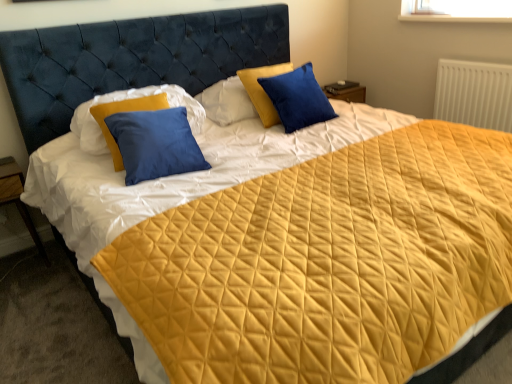
Where is `wooden at left`? wooden at left is located at coordinates (18, 198).

Find the location of `blue velvet pillow at upper center, which is counted as the second pillow, starting from the left`. blue velvet pillow at upper center, which is counted as the second pillow, starting from the left is located at coordinates (298, 98).

Locate an element on the screen. white textured radiator at upper right is located at coordinates (474, 94).

Find the location of a particular element. Image resolution: width=512 pixels, height=384 pixels. wooden at left is located at coordinates (18, 198).

Considering the sizes of objects matte blue pillow at center, which is the first pillow from left to right, and white textured radiator at upper right in the image provided, who is smaller, matte blue pillow at center, which is the first pillow from left to right, or white textured radiator at upper right?

Smaller between the two is white textured radiator at upper right.

From a real-world perspective, is matte blue pillow at center, which is the first pillow from left to right, positioned above or below white textured radiator at upper right?

matte blue pillow at center, which is the first pillow from left to right, is above white textured radiator at upper right.

Is blue velvet pillow at upper center, which ranks as the 1th pillow in right-to-left order, looking in the opposite direction of matte blue pillow at center, which is the first pillow from left to right?

No, blue velvet pillow at upper center, which ranks as the 1th pillow in right-to-left order, is not facing the opposite direction of matte blue pillow at center, which is the first pillow from left to right.

From the picture: Would you consider blue velvet pillow at upper center, which ranks as the 1th pillow in right-to-left order, to be distant from matte blue pillow at center, which is the first pillow from left to right?

No.

In the scene shown: Looking at their sizes, would you say blue velvet pillow at upper center, which is counted as the second pillow, starting from the left, is wider or thinner than matte blue pillow at center, which is the first pillow from left to right?

Clearly, blue velvet pillow at upper center, which is counted as the second pillow, starting from the left, has less width compared to matte blue pillow at center, which is the first pillow from left to right.

Is blue velvet pillow at upper center, which ranks as the 1th pillow in right-to-left order, spatially inside wooden at left, or outside of it?

blue velvet pillow at upper center, which ranks as the 1th pillow in right-to-left order, cannot be found inside wooden at left.

Considering the relative sizes of blue velvet pillow at upper center, which is counted as the second pillow, starting from the left, and wooden at left in the image provided, is blue velvet pillow at upper center, which is counted as the second pillow, starting from the left, smaller than wooden at left?

Incorrect, blue velvet pillow at upper center, which is counted as the second pillow, starting from the left, is not smaller in size than wooden at left.

From a real-world perspective, is blue velvet pillow at upper center, which ranks as the 1th pillow in right-to-left order, on top of wooden at left?

Yes.

Is wooden at left not within white textured radiator at upper right?

Absolutely, wooden at left is external to white textured radiator at upper right.

Image resolution: width=512 pixels, height=384 pixels. What are the coordinates of `radiator above the wooden at left (from the image's perspective)` in the screenshot? It's located at coord(474,94).

Is wooden at left bigger than white textured radiator at upper right?

Indeed, wooden at left has a larger size compared to white textured radiator at upper right.

Would you say blue velvet pillow at upper center, which is counted as the second pillow, starting from the left, is part of matte blue pillow at center, which is the first pillow from left to right,'s contents?

No, blue velvet pillow at upper center, which is counted as the second pillow, starting from the left, is not inside matte blue pillow at center, which is the first pillow from left to right.

Is point (156, 89) closer or farther from the camera than point (292, 91)?

Clearly, point (156, 89) is closer to the camera than point (292, 91).

Is matte blue pillow at center, which is the first pillow from left to right, not near blue velvet pillow at upper center, which ranks as the 1th pillow in right-to-left order?

matte blue pillow at center, which is the first pillow from left to right, is near blue velvet pillow at upper center, which ranks as the 1th pillow in right-to-left order, not far away.

Who is bigger, matte blue pillow at center, the second pillow from the right, or blue velvet pillow at upper center, which ranks as the 1th pillow in right-to-left order?

With larger size is matte blue pillow at center, the second pillow from the right.

Could you measure the distance between blue velvet pillow at upper center, which is counted as the second pillow, starting from the left, and white textured radiator at upper right?

1.09 meters.

From the picture: Does blue velvet pillow at upper center, which ranks as the 1th pillow in right-to-left order, have a larger size compared to white textured radiator at upper right?

Correct, blue velvet pillow at upper center, which ranks as the 1th pillow in right-to-left order, is larger in size than white textured radiator at upper right.

Is blue velvet pillow at upper center, which ranks as the 1th pillow in right-to-left order, positioned with its back to white textured radiator at upper right?

blue velvet pillow at upper center, which ranks as the 1th pillow in right-to-left order, is not turned away from white textured radiator at upper right.

Which of these two, blue velvet pillow at upper center, which ranks as the 1th pillow in right-to-left order, or white textured radiator at upper right, is thinner?

white textured radiator at upper right.

Is blue velvet pillow at upper center, which ranks as the 1th pillow in right-to-left order, completely or partially inside white textured radiator at upper right?

No.

Locate an element on the screen. This screenshot has width=512, height=384. the 1st pillow in front when counting from the white textured radiator at upper right is located at coordinates (298, 98).

Considering the positions of objects white textured radiator at upper right and blue velvet pillow at upper center, which ranks as the 1th pillow in right-to-left order, in the image provided, who is more to the left, white textured radiator at upper right or blue velvet pillow at upper center, which ranks as the 1th pillow in right-to-left order,?

Positioned to the left is blue velvet pillow at upper center, which ranks as the 1th pillow in right-to-left order.

Based on the photo, is blue velvet pillow at upper center, which is counted as the second pillow, starting from the left, at the back of white textured radiator at upper right?

No, white textured radiator at upper right's orientation is not away from blue velvet pillow at upper center, which is counted as the second pillow, starting from the left.

In the image, there is a matte blue pillow at center, which is the first pillow from left to right. Identify the location of radiator below it (from a real-world perspective). (474, 94).

Identify the location of pillow on the right of matte blue pillow at center, the second pillow from the right. This screenshot has height=384, width=512. (298, 98).

Looking at the image, which one is located closer to white textured radiator at upper right, matte blue pillow at center, which is the first pillow from left to right, or wooden at left?

The object closer to white textured radiator at upper right is matte blue pillow at center, which is the first pillow from left to right.

Based on their spatial positions, is wooden at left or white textured radiator at upper right closer to matte blue pillow at center, the second pillow from the right?

wooden at left lies closer to matte blue pillow at center, the second pillow from the right, than the other object.

Estimate the real-world distances between objects in this image. Which object is closer to wooden at left, white textured radiator at upper right or blue velvet pillow at upper center, which ranks as the 1th pillow in right-to-left order?

blue velvet pillow at upper center, which ranks as the 1th pillow in right-to-left order, is positioned closer to the anchor wooden at left.

Looking at the image, which one is located closer to wooden at left, blue velvet pillow at upper center, which ranks as the 1th pillow in right-to-left order, or matte blue pillow at center, the second pillow from the right?

Based on the image, matte blue pillow at center, the second pillow from the right, appears to be nearer to wooden at left.

Estimate the real-world distances between objects in this image. Which object is further from white textured radiator at upper right, wooden at left or matte blue pillow at center, the second pillow from the right?

Among the two, wooden at left is located further to white textured radiator at upper right.

From the image, which object appears to be nearer to matte blue pillow at center, the second pillow from the right, white textured radiator at upper right or wooden at left?

wooden at left is positioned closer to the anchor matte blue pillow at center, the second pillow from the right.

From the image, which object appears to be farther from white textured radiator at upper right, matte blue pillow at center, the second pillow from the right, or blue velvet pillow at upper center, which ranks as the 1th pillow in right-to-left order?

Based on the image, matte blue pillow at center, the second pillow from the right, appears to be further to white textured radiator at upper right.

Based on the photo, looking at the image, which one is located closer to white textured radiator at upper right, blue velvet pillow at upper center, which ranks as the 1th pillow in right-to-left order, or wooden at left?

blue velvet pillow at upper center, which ranks as the 1th pillow in right-to-left order, is closer to white textured radiator at upper right.

Find the location of `pillow situated between wooden at left and blue velvet pillow at upper center, which ranks as the 1th pillow in right-to-left order, from left to right`. pillow situated between wooden at left and blue velvet pillow at upper center, which ranks as the 1th pillow in right-to-left order, from left to right is located at coordinates (127, 99).

This screenshot has height=384, width=512. I want to click on pillow between matte blue pillow at center, which is the first pillow from left to right, and white textured radiator at upper right, so click(x=298, y=98).